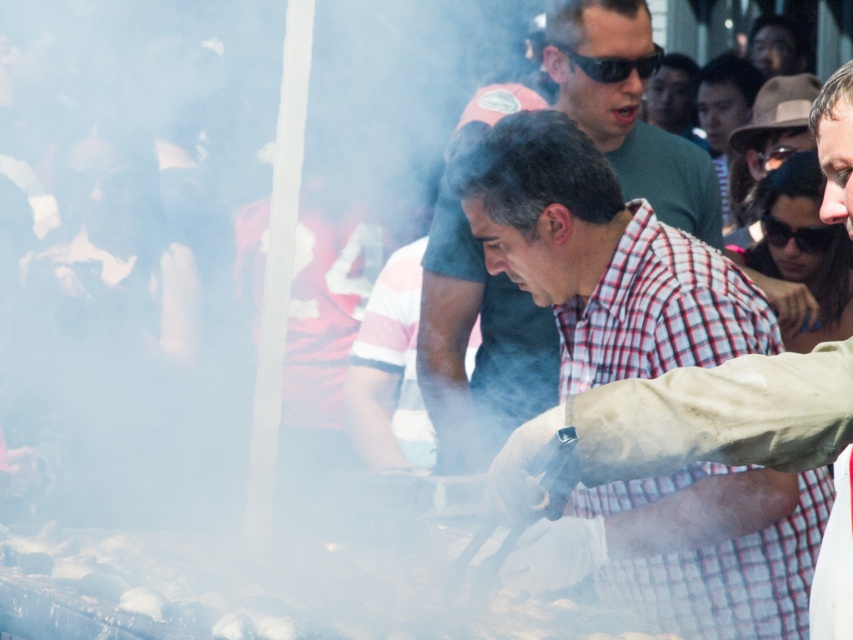
Question: Is checkered fabric shirt at center behind plaid cotton shirt at center?

Choices:
 (A) no
 (B) yes

Answer: (A)

Question: Which of the following is the farthest from the observer?

Choices:
 (A) black plastic sunglasses at upper center
 (B) plaid cotton shirt at center
 (C) checkered fabric shirt at center

Answer: (B)

Question: Can you confirm if checkered fabric shirt at center is smaller than black plastic sunglasses at upper right?

Choices:
 (A) no
 (B) yes

Answer: (A)

Question: Which point is closer to the camera?

Choices:
 (A) checkered fabric shirt at center
 (B) plaid cotton shirt at center
 (C) black plastic sunglasses at upper center
 (D) black plastic sunglasses at upper right

Answer: (A)

Question: Is plaid cotton shirt at center closer to the viewer compared to black plastic sunglasses at upper center?

Choices:
 (A) yes
 (B) no

Answer: (B)

Question: Which of the following is the closest to the observer?

Choices:
 (A) (619, 64)
 (B) (596, 4)
 (C) (802, 248)

Answer: (A)